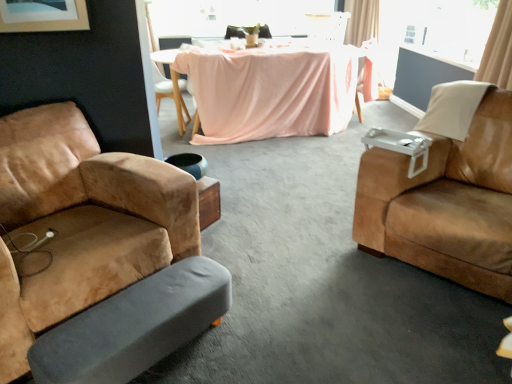
Identify the location of blank space above gray fabric footrest at lower left (from a real-world perspective). This screenshot has width=512, height=384. (137, 309).